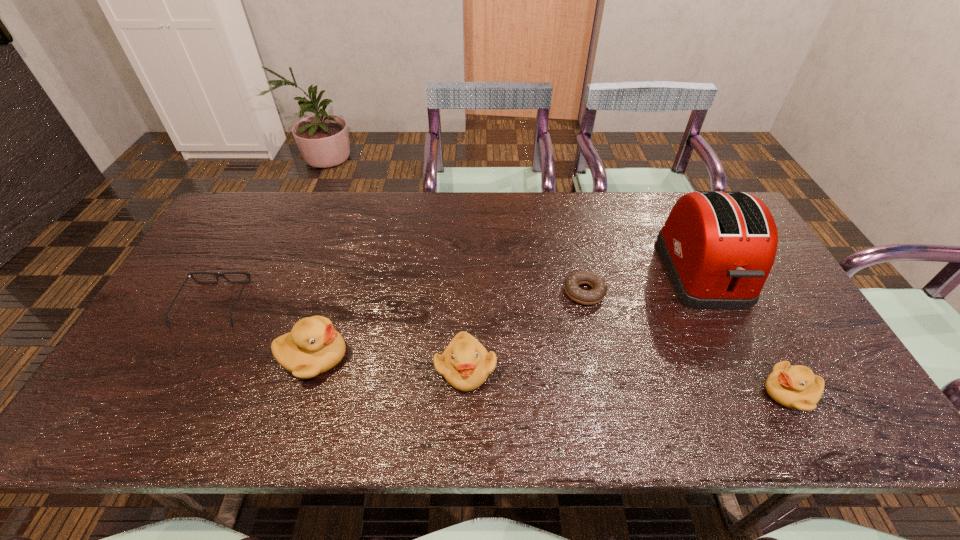
The width and height of the screenshot is (960, 540). Find the location of `vacant space that satisfies the following two spatial constraints: 1. on the back side of the tallest object; 2. on the right side of the doughnut`. vacant space that satisfies the following two spatial constraints: 1. on the back side of the tallest object; 2. on the right side of the doughnut is located at coordinates (580, 273).

Locate an element on the screen. The width and height of the screenshot is (960, 540). free location that satisfies the following two spatial constraints: 1. on the front side of the doughnut; 2. at the beak of the leftmost duckling is located at coordinates (599, 357).